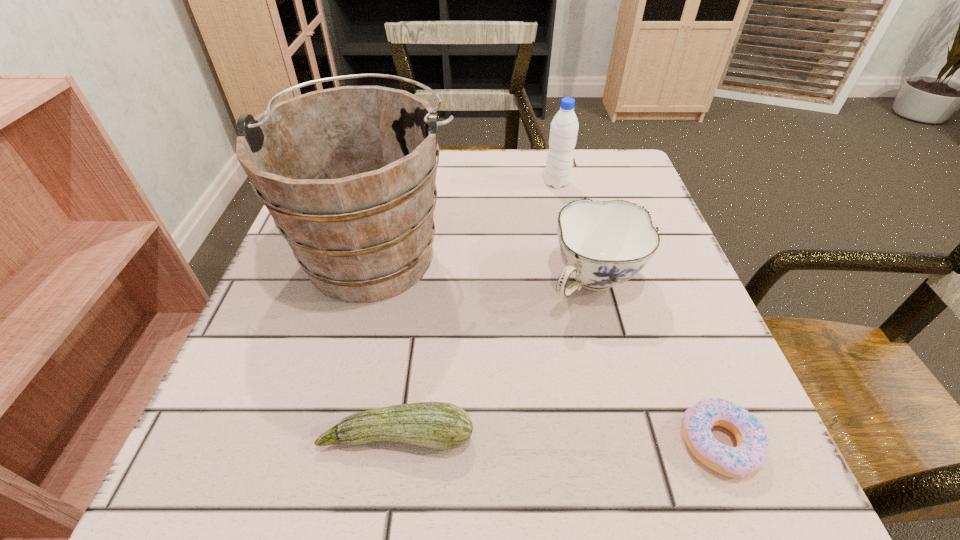
Locate an element on the screen. doughnut at the right edge is located at coordinates (752, 450).

At what (x,y) coordinates should I click in order to perform the action: click on object present at the far left corner. Please return your answer as a coordinate pair (x, y). This screenshot has height=540, width=960. Looking at the image, I should click on (348, 174).

Locate an element on the screen. This screenshot has height=540, width=960. object present at the near left corner is located at coordinates [x=439, y=425].

You are a GUI agent. You are given a task and a screenshot of the screen. Output one action in this format:
    pyautogui.click(x=<x>, y=<y>)
    Task: Click on the object positioned at the near right corner
    
    Given the screenshot: What is the action you would take?
    pyautogui.click(x=752, y=450)

Identify the location of vacant space at the far edge. The height and width of the screenshot is (540, 960). (560, 188).

Find the location of a particular element. The image size is (960, 540). blank space at the near edge is located at coordinates (337, 487).

The width and height of the screenshot is (960, 540). In the image, there is a desktop. What are the coordinates of `free space at the left edge` in the screenshot? It's located at (244, 338).

Where is `blank space at the right edge of the desktop`? The height and width of the screenshot is (540, 960). blank space at the right edge of the desktop is located at coordinates (608, 322).

Identify the location of vacant space at the near right corner of the desktop. Image resolution: width=960 pixels, height=540 pixels. (746, 501).

The image size is (960, 540). What are the coordinates of `free area in between the fourth tallest object and the tallest object` in the screenshot? It's located at (386, 343).